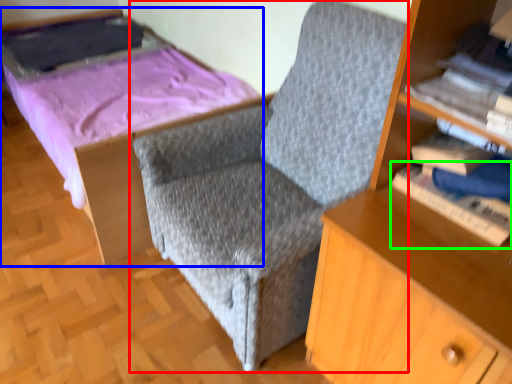
Question: Considering the real-world distances, which object is closest to chair (highlighted by a red box)? bed (highlighted by a blue box) or book (highlighted by a green box).

Choices:
 (A) bed
 (B) book

Answer: (B)